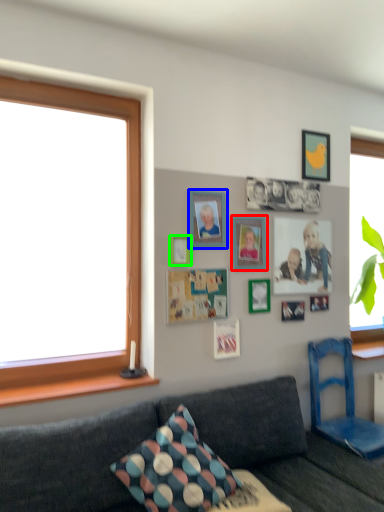
Question: Considering the real-world distances, which object is closest to picture frame (highlighted by a red box)? picture frame (highlighted by a blue box) or picture frame (highlighted by a green box).

Choices:
 (A) picture frame
 (B) picture frame

Answer: (A)